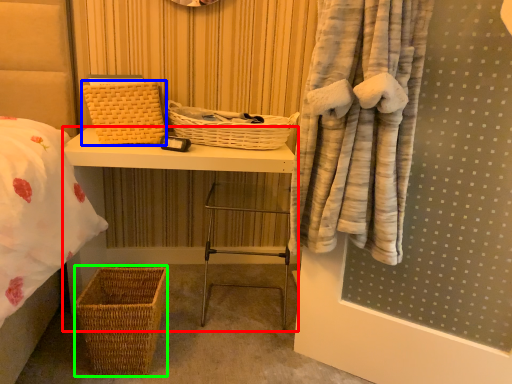
Question: Based on their relative distances, which object is nearer to furniture (highlighted by a red box)? Choose from basket (highlighted by a blue box) and basket (highlighted by a green box).

Choices:
 (A) basket
 (B) basket

Answer: (A)